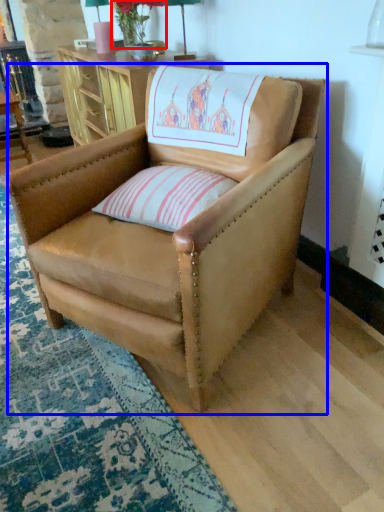
Question: Which object is closer to the camera taking this photo, flower (highlighted by a red box) or chair (highlighted by a blue box)?

Choices:
 (A) flower
 (B) chair

Answer: (B)